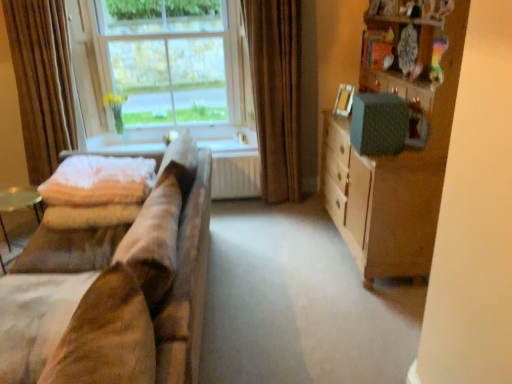
Locate an element on the screen. The image size is (512, 384). free space in front of brown velvet curtain at center, which ranks as the 1th curtain in right-to-left order is located at coordinates (269, 216).